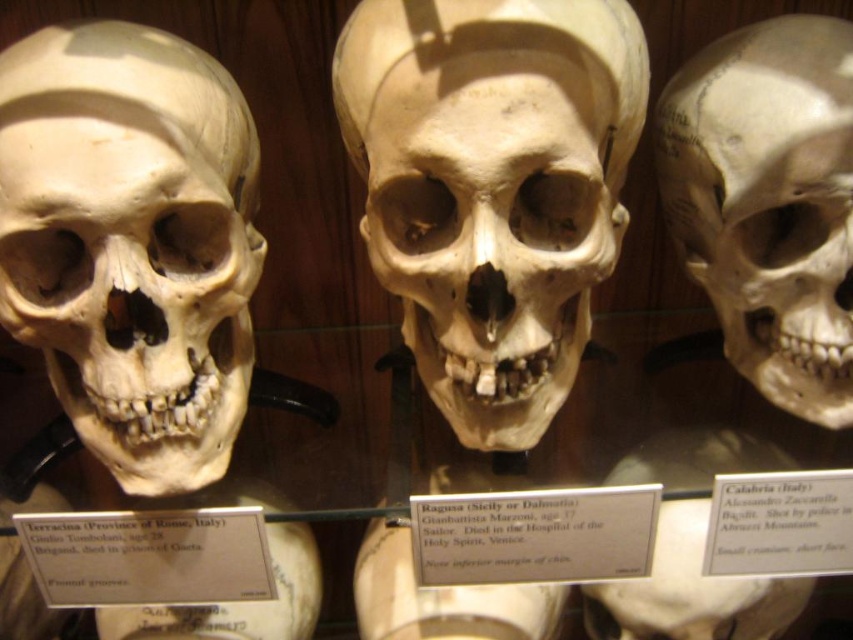
Between point (798, 28) and point (262, 625), which one is positioned behind?

The point (262, 625) is behind.

Is matte white skull at right below matte white skull at center?

Incorrect, matte white skull at right is not positioned below matte white skull at center.

Between point (737, 301) and point (248, 616), which one is positioned behind?

Positioned behind is point (248, 616).

The height and width of the screenshot is (640, 853). Identify the location of matte white skull at right. (769, 202).

Which is behind, point (753, 112) or point (752, 461)?

Positioned behind is point (752, 461).

Does point (755, 384) come behind point (752, 625)?

No, it is not.

At what (x,y) coordinates should I click in order to perform the action: click on matte white skull at right. Please return your answer as a coordinate pair (x, y). Looking at the image, I should click on (769, 202).

At what (x,y) coordinates should I click in order to perform the action: click on matte white skull at right. Please return your answer as a coordinate pair (x, y). The width and height of the screenshot is (853, 640). Looking at the image, I should click on (769, 202).

Can you confirm if white matte skull at center is bigger than matte white skull at center?

Yes, white matte skull at center is bigger than matte white skull at center.

Is white matte skull at center wider than matte white skull at center?

Indeed, white matte skull at center has a greater width compared to matte white skull at center.

Does point (711, 483) come in front of point (317, 563)?

That is True.

Locate an element on the screen. Image resolution: width=853 pixels, height=640 pixels. white matte skull at center is located at coordinates 693,548.